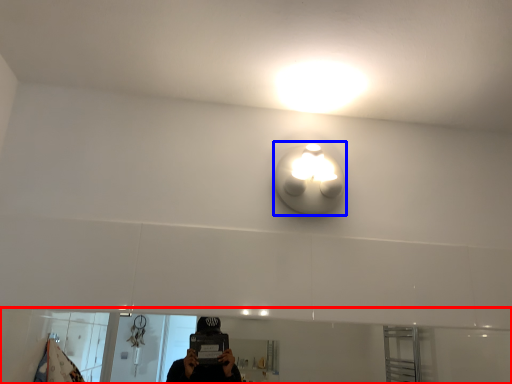
Question: Which object appears farthest to the camera in this image, mirror (highlighted by a red box) or light (highlighted by a blue box)?

Choices:
 (A) mirror
 (B) light

Answer: (B)